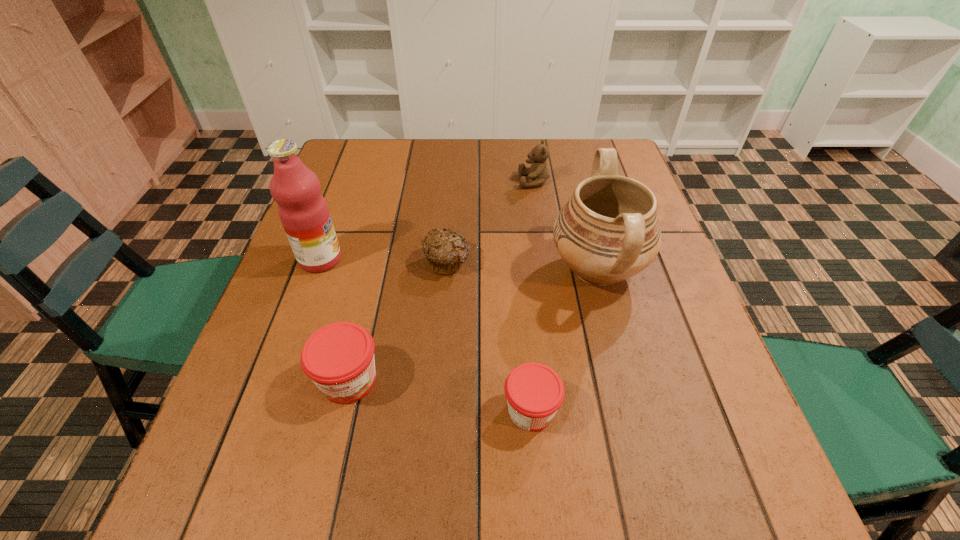
Identify the location of vacant space in between the third shortest object and the teddy bear. (442, 280).

Locate an element on the screen. This screenshot has width=960, height=540. vacant point located between the urn and the third object from left to right is located at coordinates (522, 265).

Find the location of a particular element. The height and width of the screenshot is (540, 960). free space between the third object from left to right and the fourth tallest object is located at coordinates (397, 321).

The width and height of the screenshot is (960, 540). What are the coordinates of `vacant space in between the shorter jam and the urn` in the screenshot? It's located at (564, 340).

The width and height of the screenshot is (960, 540). What are the coordinates of `vacant point located between the third shortest object and the fourth object from right to left` in the screenshot? It's located at (397, 321).

You are a GUI agent. You are given a task and a screenshot of the screen. Output one action in this format:
    pyautogui.click(x=<x>, y=<y>)
    Task: Click on the vacant point located between the shorter jam and the fifth shortest object
    The height and width of the screenshot is (540, 960).
    Given the screenshot: What is the action you would take?
    pyautogui.click(x=564, y=340)

Locate an element on the screen. vacant space in between the tallest object and the left jam is located at coordinates (335, 320).

Where is `vacant space that's between the third object from left to right and the right jam`? vacant space that's between the third object from left to right and the right jam is located at coordinates (489, 336).

Locate which object is the fourth closest to the leftmost object. Please provide its 2D coordinates. Your answer should be formatted as a tuple, i.e. [(x, y)], where the tuple contains the x and y coordinates of a point satisfying the conditions above.

[(608, 231)]

The height and width of the screenshot is (540, 960). Find the location of `object that ranks as the fifth closest to the teddy bear`. object that ranks as the fifth closest to the teddy bear is located at coordinates (339, 358).